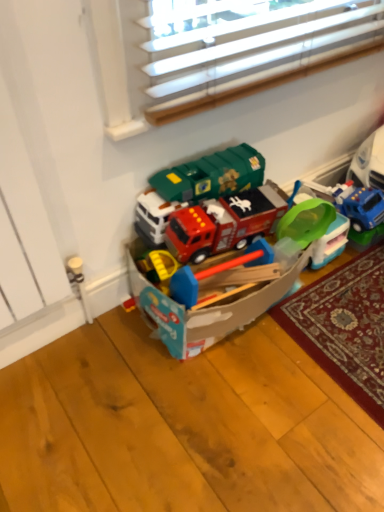
Question: Which direction should I rotate to face matte plastic toy box at center, the second toy positioned from the right, — up or down?

Choices:
 (A) up
 (B) down

Answer: (A)

Question: Could you tell me if translucent plastic bucket at center, which is the 1th toy from right to left, is facing matte plastic toy box at center, the second toy positioned from the right?

Choices:
 (A) yes
 (B) no

Answer: (B)

Question: Is matte plastic toy box at center, which is the 1th toy in left-to-right order, at the back of translucent plastic bucket at center, which is the 2th toy from left to right?

Choices:
 (A) no
 (B) yes

Answer: (A)

Question: Is matte plastic toy box at center, the second toy positioned from the right, inside translucent plastic bucket at center, which is the 2th toy from left to right?

Choices:
 (A) yes
 (B) no

Answer: (B)

Question: From a real-world perspective, is translucent plastic bucket at center, which is the 1th toy from right to left, physically above matte plastic toy box at center, which is the 1th toy in left-to-right order?

Choices:
 (A) no
 (B) yes

Answer: (A)

Question: Is translucent plastic bucket at center, which is the 2th toy from left to right, not inside matte plastic toy box at center, which is the 1th toy in left-to-right order?

Choices:
 (A) no
 (B) yes

Answer: (B)

Question: Can you confirm if translucent plastic bucket at center, which is the 1th toy from right to left, is bigger than matte plastic toy box at center, the second toy positioned from the right?

Choices:
 (A) no
 (B) yes

Answer: (A)

Question: Can you see matte plastic toy box at center, which is the 1th toy in left-to-right order, touching translucent plastic bucket at center, which is the 2th toy from left to right?

Choices:
 (A) yes
 (B) no

Answer: (B)

Question: From a real-world perspective, is matte plastic toy box at center, the second toy positioned from the right, on top of translucent plastic bucket at center, which is the 2th toy from left to right?

Choices:
 (A) yes
 (B) no

Answer: (A)

Question: From a real-world perspective, is matte plastic toy box at center, which is the 1th toy in left-to-right order, beneath translucent plastic bucket at center, which is the 2th toy from left to right?

Choices:
 (A) yes
 (B) no

Answer: (B)

Question: Is there a large distance between matte plastic toy box at center, which is the 1th toy in left-to-right order, and translucent plastic bucket at center, which is the 2th toy from left to right?

Choices:
 (A) no
 (B) yes

Answer: (A)

Question: Is matte plastic toy box at center, the second toy positioned from the right, positioned in front of translucent plastic bucket at center, which is the 2th toy from left to right?

Choices:
 (A) no
 (B) yes

Answer: (B)

Question: Can you confirm if matte plastic toy box at center, which is the 1th toy in left-to-right order, is thinner than translucent plastic bucket at center, which is the 1th toy from right to left?

Choices:
 (A) no
 (B) yes

Answer: (A)

Question: Which is correct: translucent plastic bucket at center, which is the 2th toy from left to right, is inside matte plastic toy box at center, which is the 1th toy in left-to-right order, or outside of it?

Choices:
 (A) inside
 (B) outside

Answer: (B)